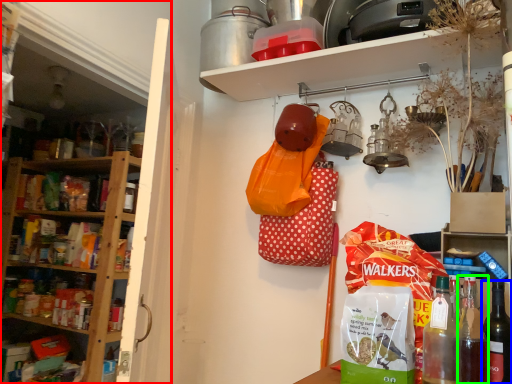
Question: Based on their relative distances, which object is farther from shelf (highlighted by a red box)? Choose from bottle (highlighted by a blue box) and bottle (highlighted by a green box).

Choices:
 (A) bottle
 (B) bottle

Answer: (A)